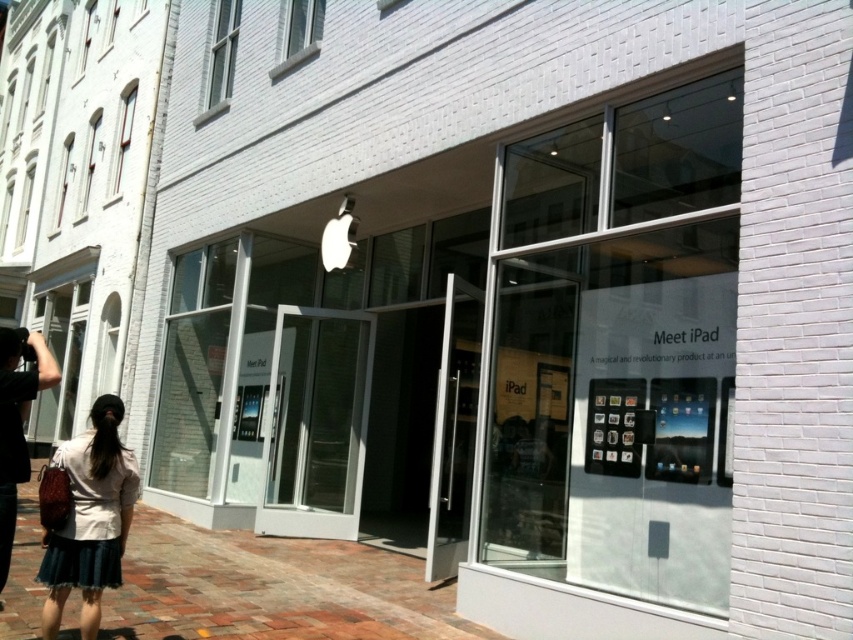
You are standing at the point marked by coordinates point (418, 573). You want to enter the Apple store through its entrance. Can you estimate how far you are from the store entrance?

The distance between point (418, 573) and the viewer is 5.67 meters, so you are 5.67 meters away from the entrance of the Apple store.

You are standing at the corner of the street where the Apple Store is located. There is a point marked at coordinates point [341,637]. Can you determine if this point is within a safe distance for a pedestrian to cross the street without obstructing traffic?

The point [341,637] is 3.86 meters from the viewer. Since this distance is within a typical safe crossing distance for pedestrians, it is likely safe to cross at this point without obstructing traffic.

You are standing outside the Apple store and see a point marked at coordinates [90,518]. What object is located at that point?

The point at coordinates [90,518] marks the denim skirt at lower left.